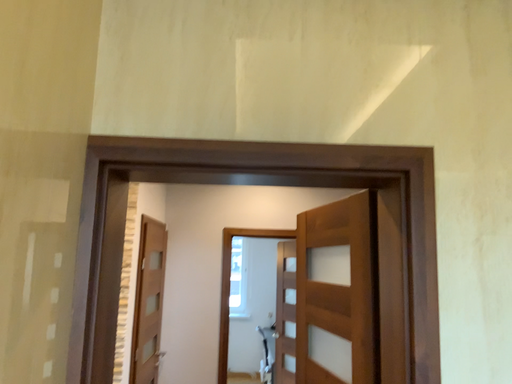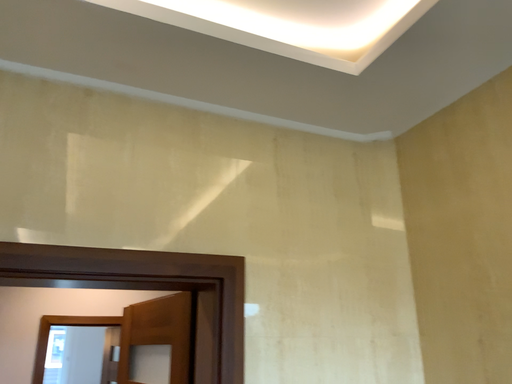
Question: How did the camera likely rotate when shooting the video?

Choices:
 (A) rotated downward
 (B) rotated upward

Answer: (B)